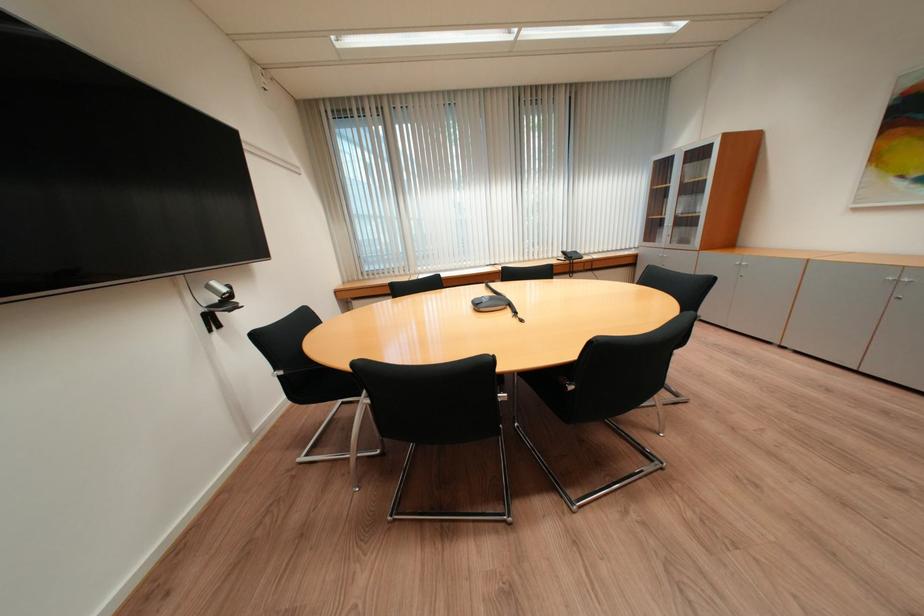
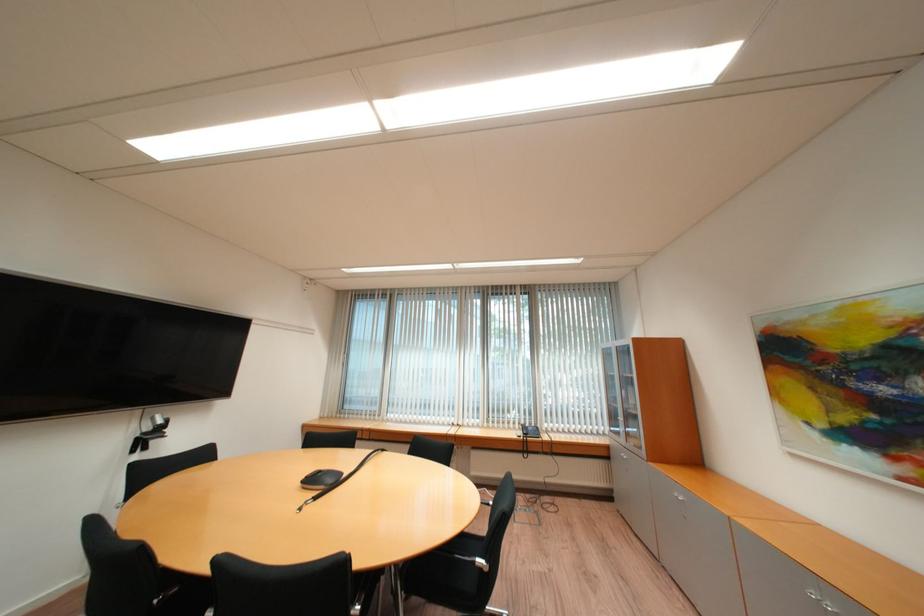
Find the pixel in the second image that matches [217,289] in the first image.

(162, 419)